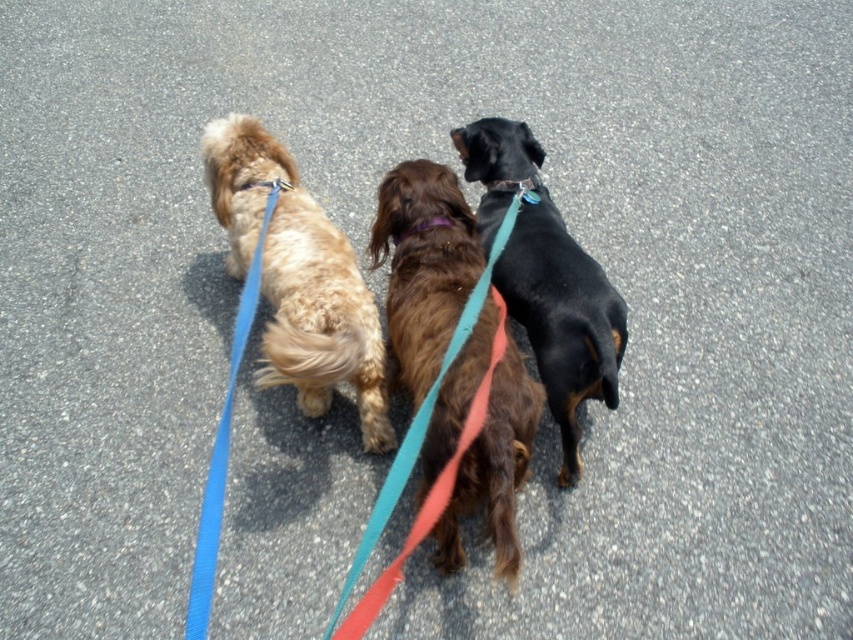
You are a drone operator trying to capture a photo of the three dogs walking on the paved surface. The dogs are positioned at point (614,291). To ensure all three dogs are in frame, what is the minimum distance your camera should be able to focus on?

The three dogs are positioned at point (614,291) and are 2.15 meters apart. To ensure all three dogs are in frame, the camera should be able to focus at least 2.15 meters away.

You are standing at the origin point of the coordinate system. You see three dogs walking away from you on a paved surface. The dogs are at the following coordinates relative to you. The light brown fur at left is located at point (297,276). The middle dog is at point 0.555, 0.455. The black dog with tan markings is at point 0.678, 0.567. Which dog is closest to you?

The light brown fur at left is closest to you because it has the smallest coordinate values of (297,276) compared to the middle dog at 0.555, 0.455 and the black dog with tan markings at 0.678, 0.567.

You are standing behind three dogs on a gray paved path. You notice the light brown fur at left and the blue fabric leash at left. Which one is shorter in height?

The light brown fur at left is shorter in height than the blue fabric leash at left.